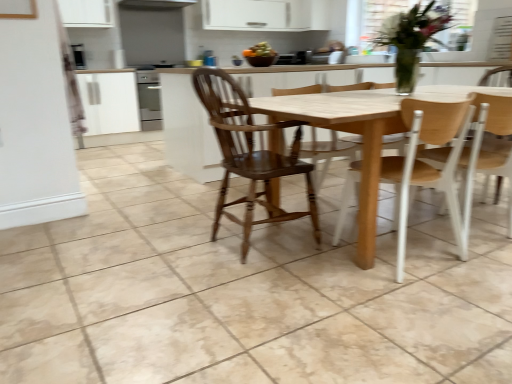
Find the location of a particular element. This screenshot has height=384, width=512. free space to the right of wooden chair at center, which appears as the 3th chair when viewed from the right is located at coordinates (328, 250).